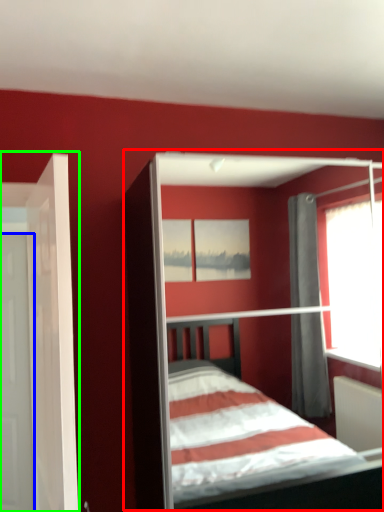
Question: Which object is the closest to the bed (highlighted by a red box)? Choose among these: door (highlighted by a blue box) or door (highlighted by a green box).

Choices:
 (A) door
 (B) door

Answer: (A)